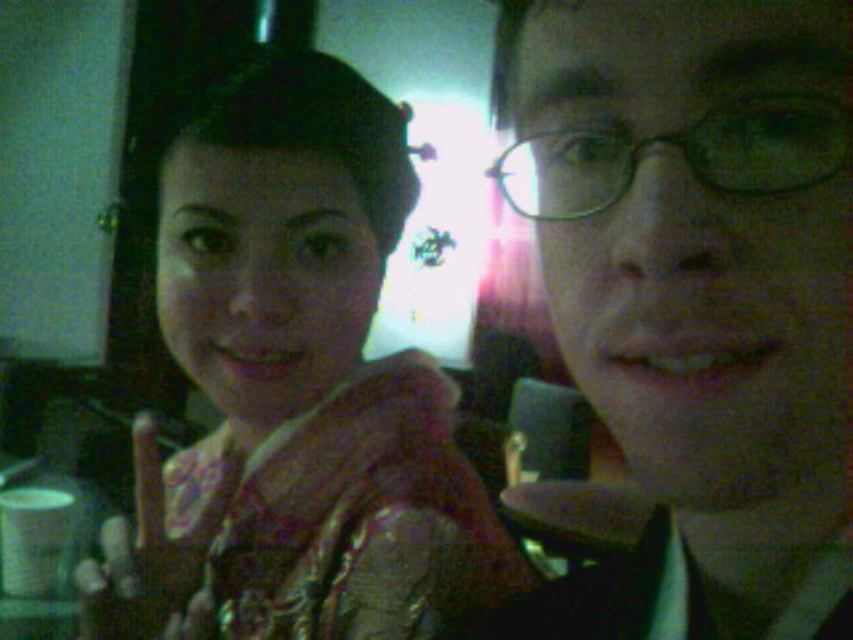
Question: Among these objects, which one is farthest from the camera?

Choices:
 (A) matte black glasses at center
 (B) shiny gold dress at center

Answer: (B)

Question: Which point is farther from the camera taking this photo?

Choices:
 (A) (798, 612)
 (B) (192, 561)

Answer: (B)

Question: Is matte black glasses at center bigger than shiny gold dress at center?

Choices:
 (A) no
 (B) yes

Answer: (A)

Question: Is matte black glasses at center to the right of shiny gold dress at center from the viewer's perspective?

Choices:
 (A) no
 (B) yes

Answer: (B)

Question: Can you confirm if matte black glasses at center is positioned to the right of shiny gold dress at center?

Choices:
 (A) yes
 (B) no

Answer: (A)